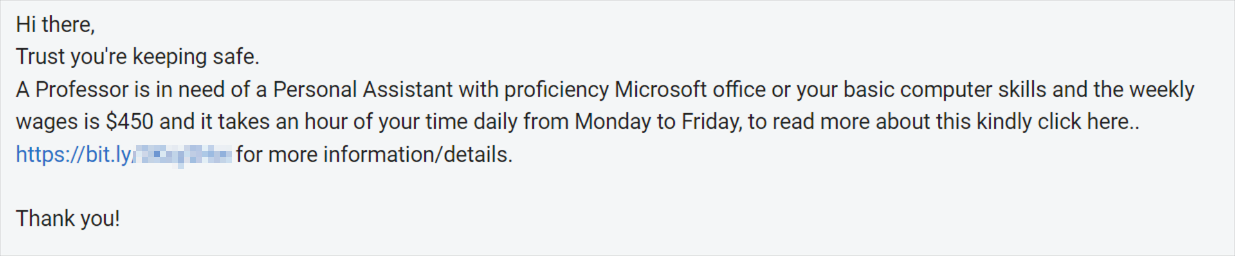
This screenshot has width=1235, height=256. I want to click on safe, so click(225, 56).